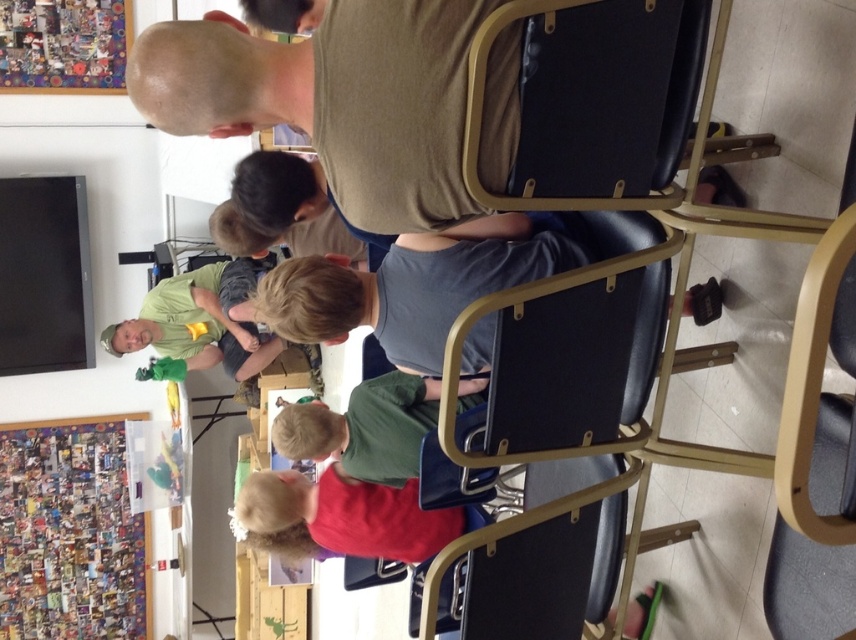
Does brown matte shirt at upper center have a greater height compared to red matte shirt at lower center?

Incorrect, brown matte shirt at upper center's height is not larger of red matte shirt at lower center's.

Identify the location of brown matte shirt at upper center. The width and height of the screenshot is (856, 640). (333, 99).

Which is behind, point (449, 80) or point (314, 516)?

The point (314, 516) is more distant.

Image resolution: width=856 pixels, height=640 pixels. Identify the location of brown matte shirt at upper center. (333, 99).

Is red matte shirt at lower center bigger than green fabric shirt at center?

Incorrect, red matte shirt at lower center is not larger than green fabric shirt at center.

Can you confirm if red matte shirt at lower center is positioned below green fabric shirt at center?

Indeed, red matte shirt at lower center is positioned under green fabric shirt at center.

This screenshot has width=856, height=640. Describe the element at coordinates (342, 516) in the screenshot. I see `red matte shirt at lower center` at that location.

Find the location of a particular element. Image resolution: width=856 pixels, height=640 pixels. red matte shirt at lower center is located at coordinates (342, 516).

Does gray matte shirt at center have a lesser height compared to green fabric shirt at center?

Yes, gray matte shirt at center is shorter than green fabric shirt at center.

Locate an element on the screen. gray matte shirt at center is located at coordinates (405, 292).